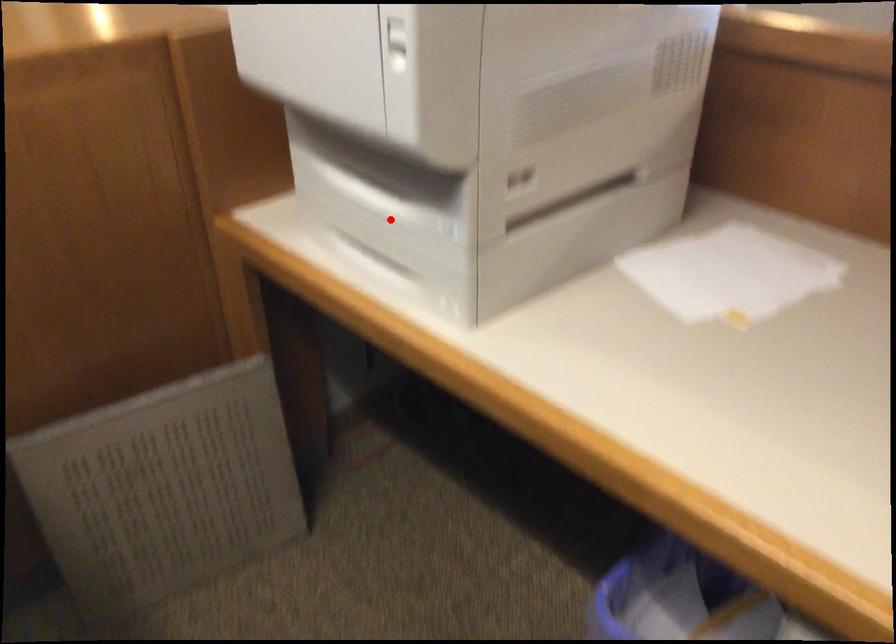
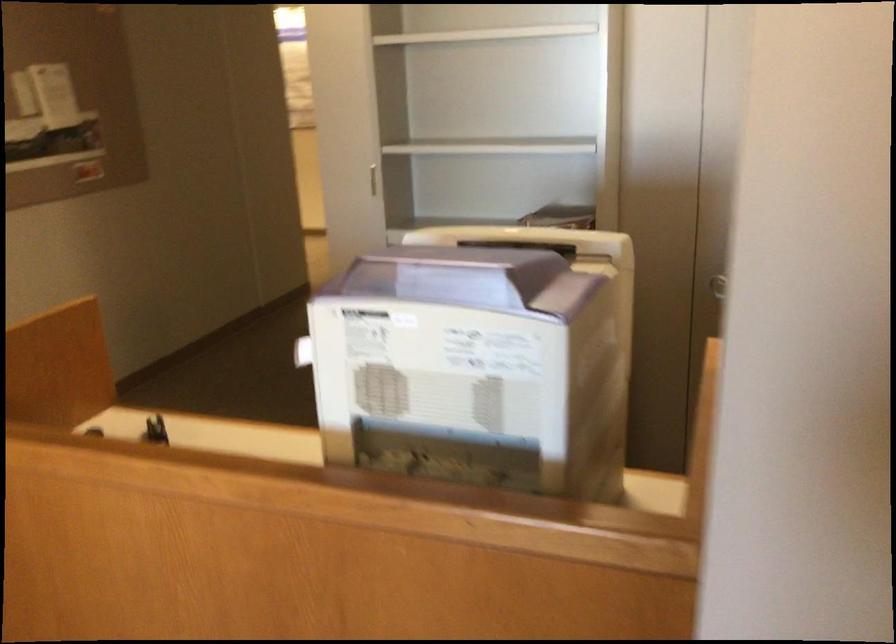
Question: I am providing you with two images of the same scene from different viewpoints. A red point is marked on the first image. At the location where the point appears in image 1, is it still visible in image 2?

Choices:
 (A) Yes
 (B) No

Answer: (B)